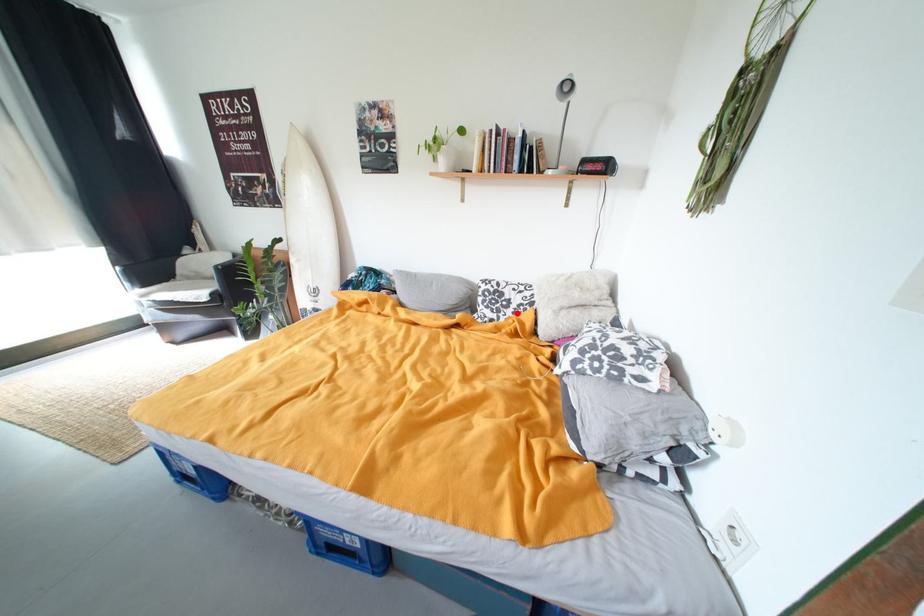
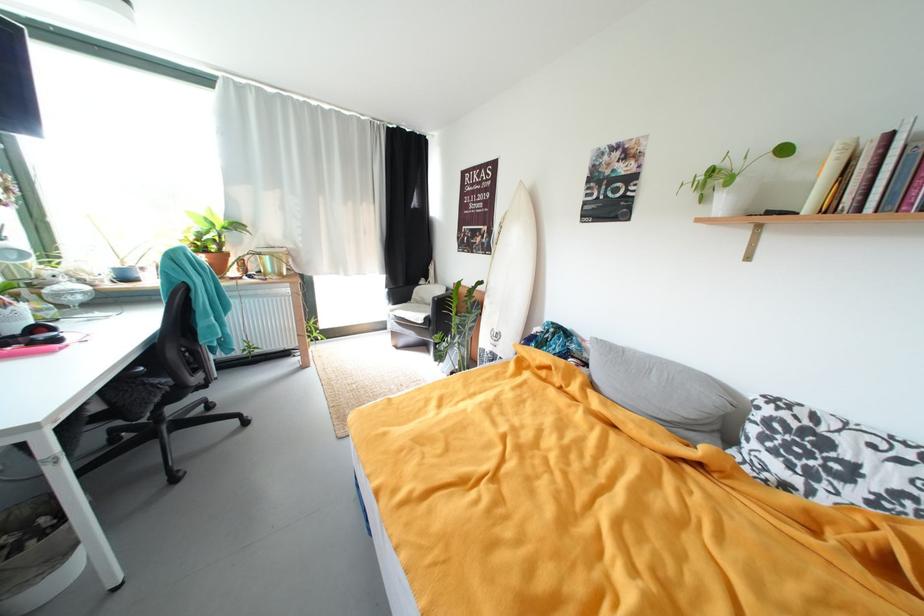
The point at the highlighted location is marked in the first image. Where is the corresponding point in the second image?

(861, 493)